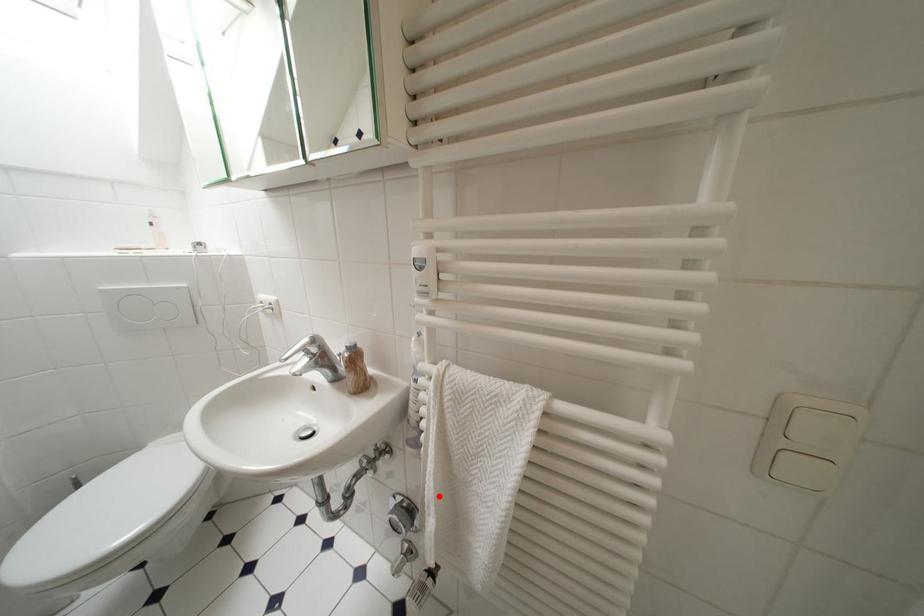
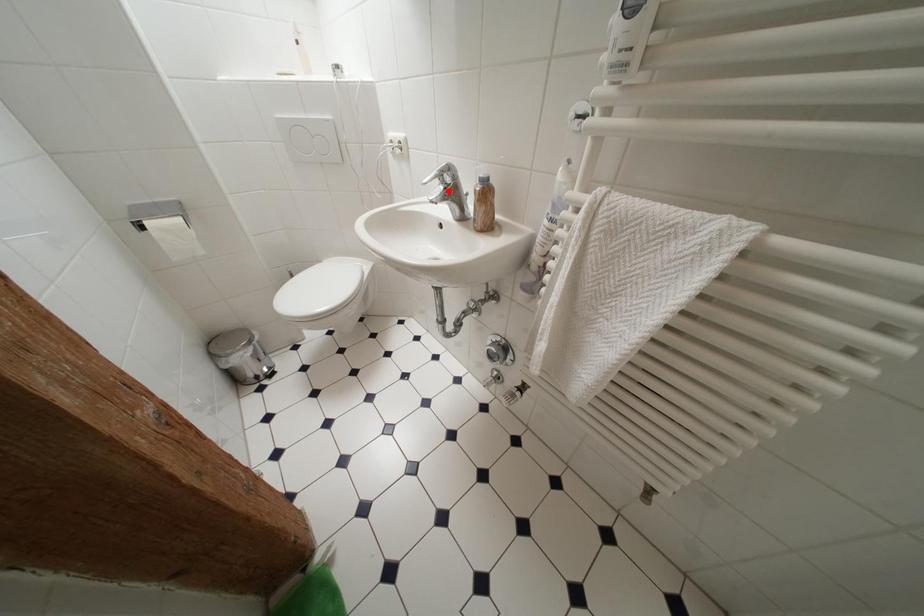
I am providing you with two images of the same scene from different viewpoints. A red point is marked on the first image and another point is marked on the second image. Does the point marked in image1 correspond to the same location as the one in image2?

No